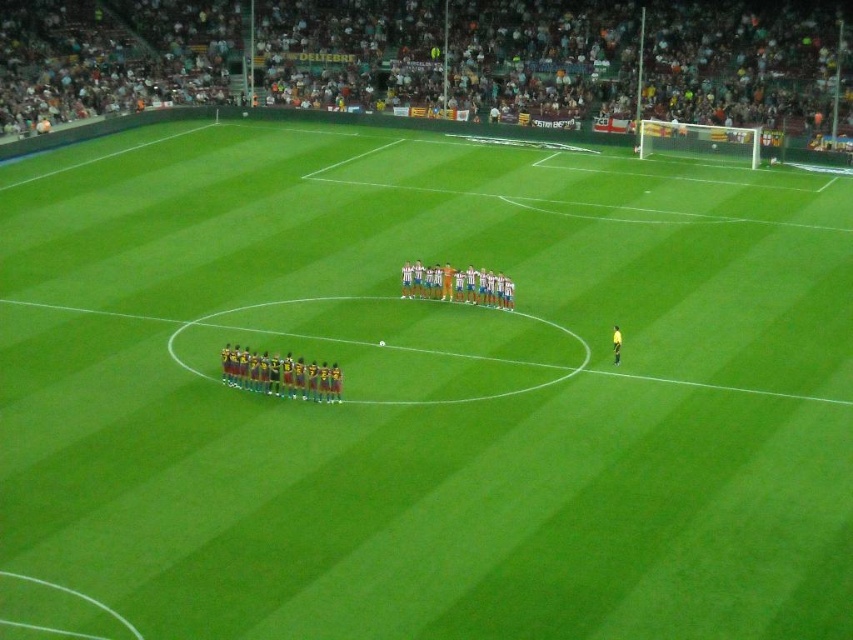
You are a photographer standing at the edge of the soccer field. You want to take a photo that includes both the point at coordinates point (277, 388) and point (618, 355). Which point will appear larger in your photo?

Point (277, 388) will appear larger in the photo because it is closer to the camera than point (618, 355).